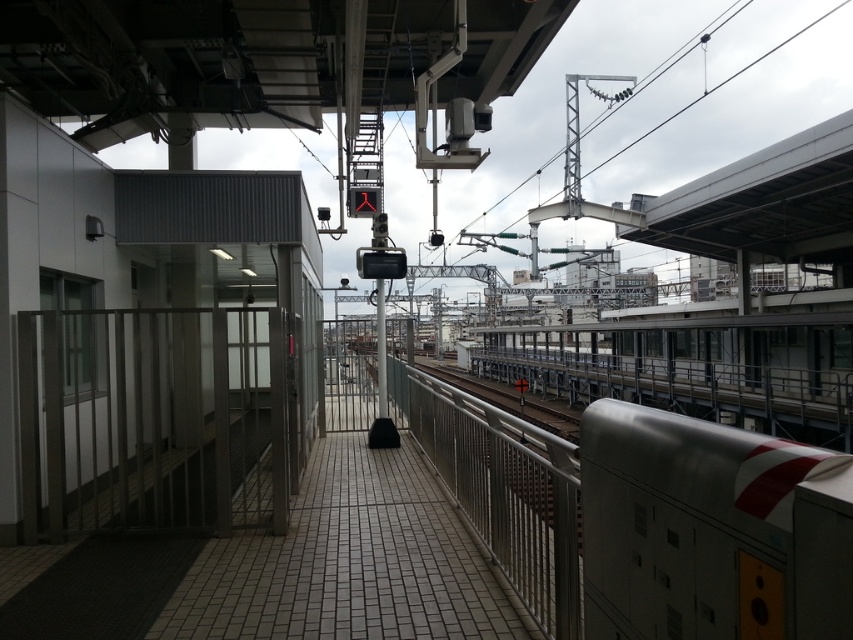
Question: Can you confirm if metallic gate at left is positioned above silver metallic train at right?

Choices:
 (A) yes
 (B) no

Answer: (B)

Question: From the image, what is the correct spatial relationship of metallic gate at left in relation to silver metallic train at right?

Choices:
 (A) below
 (B) above

Answer: (A)

Question: Considering the real-world distances, which object is closest to the silver metallic train at right?

Choices:
 (A) metallic gate at left
 (B) satin silver rail at center

Answer: (B)

Question: Which of the following is the farthest from the observer?

Choices:
 (A) [x=467, y=504]
 (B) [x=149, y=445]

Answer: (B)

Question: Which point is closer to the camera taking this photo?

Choices:
 (A) (738, 474)
 (B) (569, 470)

Answer: (A)

Question: Is metallic gate at left below silver metallic train at right?

Choices:
 (A) no
 (B) yes

Answer: (B)